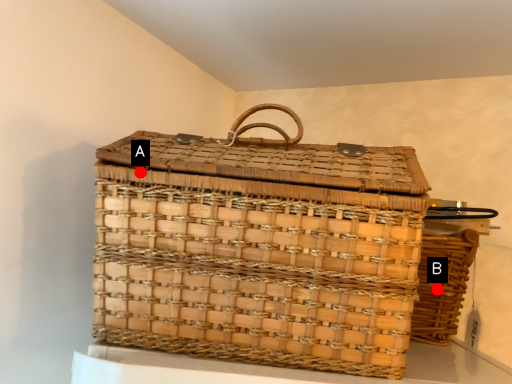
Question: Two points are circled on the image, labeled by A and B beside each circle. Which point is farther to the camera?

Choices:
 (A) A is further
 (B) B is further

Answer: (B)